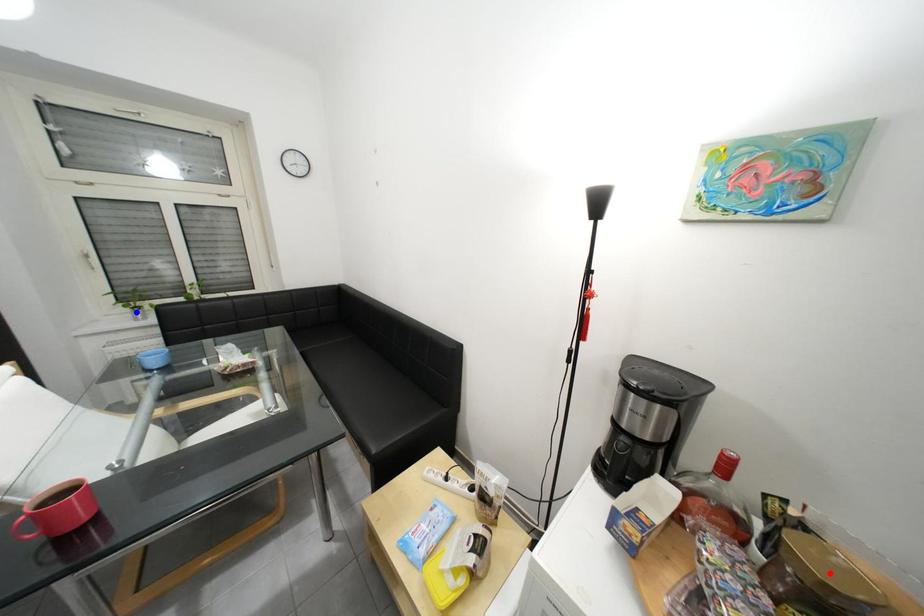
Question: Which of the two points in the image is closer to the camera?

Choices:
 (A) Blue point is closer.
 (B) Red point is closer.

Answer: (B)